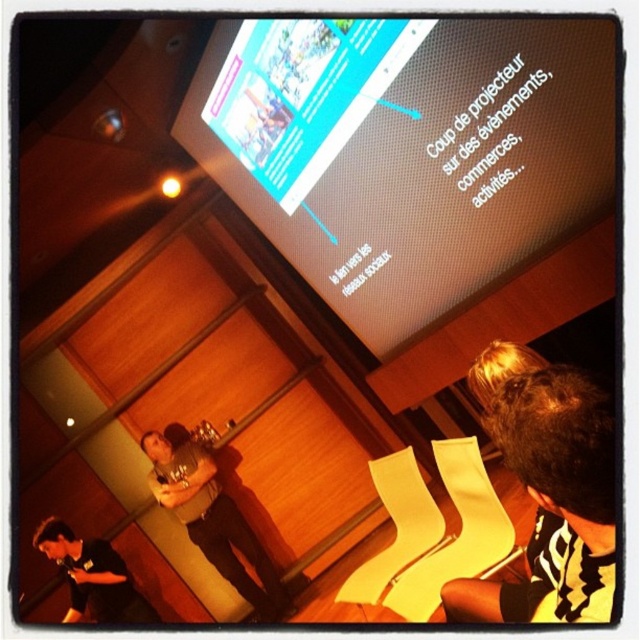
Between point (524, 116) and point (129, 612), which one is positioned in front?

Point (524, 116) is more forward.

From the picture: Who is shorter, matte black screen at upper center or black shirt at lower left?

black shirt at lower left

What do you see at coordinates (406, 150) in the screenshot? I see `matte black screen at upper center` at bounding box center [406, 150].

This screenshot has width=640, height=640. I want to click on matte black screen at upper center, so click(406, 150).

Which is in front, point (416, 243) or point (236, 564)?

Positioned in front is point (416, 243).

What do you see at coordinates (406, 150) in the screenshot? I see `matte black screen at upper center` at bounding box center [406, 150].

The image size is (640, 640). In order to click on matte black screen at upper center in this screenshot , I will do `click(406, 150)`.

Is dark brown hair at lower right closer to camera compared to black shirt at lower left?

Yes, dark brown hair at lower right is in front of black shirt at lower left.

Does dark brown hair at lower right have a smaller size compared to black shirt at lower left?

Yes, dark brown hair at lower right is smaller than black shirt at lower left.

You are a GUI agent. You are given a task and a screenshot of the screen. Output one action in this format:
    pyautogui.click(x=<x>, y=<y>)
    Task: Click on the dark brown hair at lower right
    This screenshot has height=640, width=640.
    Given the screenshot: What is the action you would take?
    pyautogui.click(x=554, y=500)